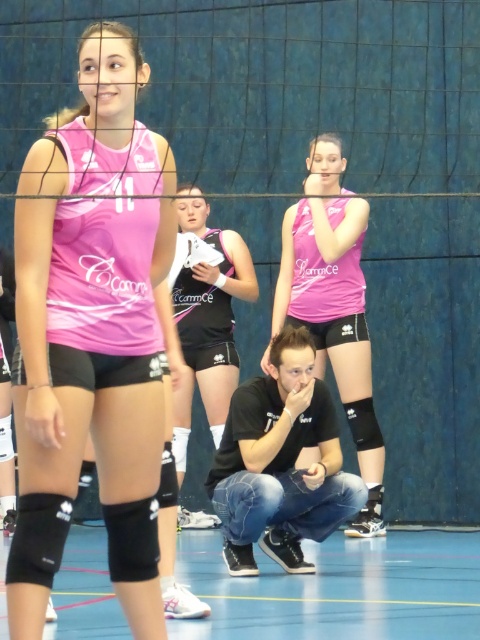
Question: Which point is farther to the camera?

Choices:
 (A) pink matte jersey at center
 (B) matte pink jersey at center
 (C) black matte shorts at center
 (D) black denim jeans at center

Answer: (C)

Question: Which of the following is the closest to the observer?

Choices:
 (A) (350, 531)
 (B) (87, 218)
 (C) (263, 476)

Answer: (B)

Question: Which of these objects is positioned farthest from the matte pink jersey at center?

Choices:
 (A) black matte shorts at center
 (B) pink matte jersey at center
 (C) black denim jeans at center

Answer: (B)

Question: Does pink matte jersey at center have a greater width compared to black matte shorts at center?

Choices:
 (A) yes
 (B) no

Answer: (A)

Question: Does black denim jeans at center have a larger size compared to black matte shorts at center?

Choices:
 (A) yes
 (B) no

Answer: (B)

Question: Does matte pink jersey at center have a larger size compared to black denim jeans at center?

Choices:
 (A) no
 (B) yes

Answer: (A)